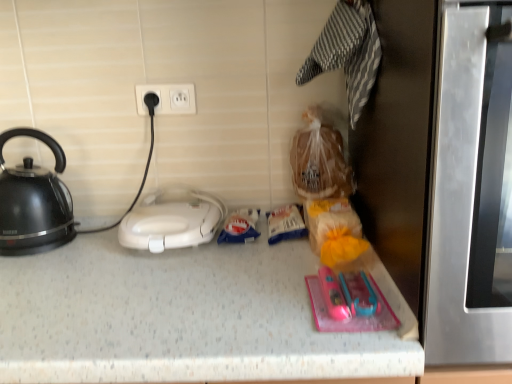
Question: From a real-world perspective, is white plastic toaster at center positioned over black glossy kettle at left based on gravity?

Choices:
 (A) yes
 (B) no

Answer: (B)

Question: Is white plastic toaster at center aimed at black glossy kettle at left?

Choices:
 (A) no
 (B) yes

Answer: (A)

Question: Are white plastic toaster at center and black glossy kettle at left far apart?

Choices:
 (A) no
 (B) yes

Answer: (A)

Question: Is white plastic toaster at center shorter than black glossy kettle at left?

Choices:
 (A) no
 (B) yes

Answer: (B)

Question: From the image's perspective, is white plastic toaster at center below black glossy kettle at left?

Choices:
 (A) no
 (B) yes

Answer: (B)

Question: Is white plastic toaster at center located outside black glossy kettle at left?

Choices:
 (A) no
 (B) yes

Answer: (B)

Question: Does stainless steel oven at right turn towards white plastic electric outlet at upper center?

Choices:
 (A) yes
 (B) no

Answer: (B)

Question: Is stainless steel oven at right touching white plastic electric outlet at upper center?

Choices:
 (A) yes
 (B) no

Answer: (B)

Question: Does stainless steel oven at right appear on the right side of white plastic electric outlet at upper center?

Choices:
 (A) no
 (B) yes

Answer: (B)

Question: From a real-world perspective, is stainless steel oven at right over white plastic electric outlet at upper center?

Choices:
 (A) yes
 (B) no

Answer: (B)

Question: Is white plastic electric outlet at upper center inside stainless steel oven at right?

Choices:
 (A) yes
 (B) no

Answer: (B)

Question: Considering the relative positions of stainless steel oven at right and white plastic electric outlet at upper center in the image provided, is stainless steel oven at right in front of white plastic electric outlet at upper center?

Choices:
 (A) yes
 (B) no

Answer: (A)

Question: Does white plastic toaster at center have a greater width compared to stainless steel oven at right?

Choices:
 (A) yes
 (B) no

Answer: (B)